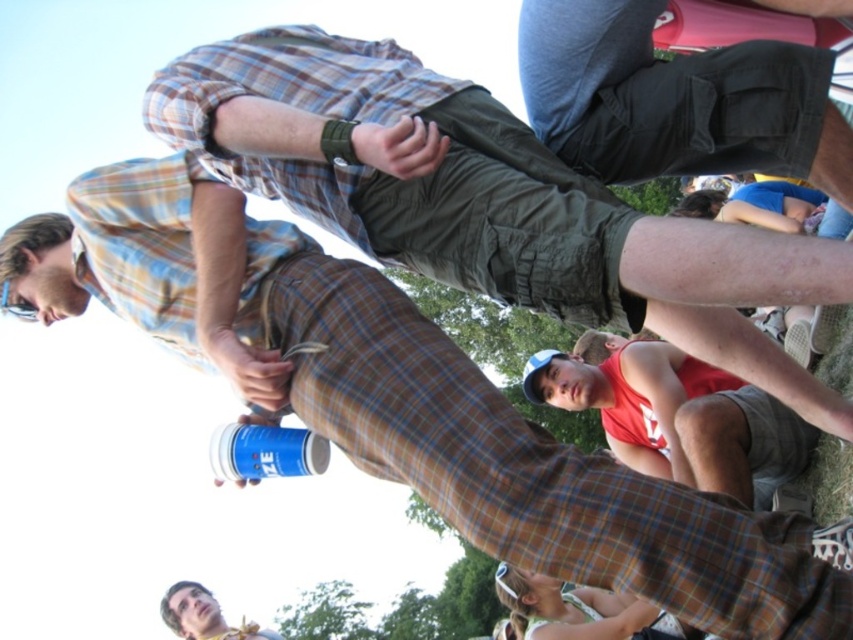
Question: Is dark gray cargo shorts at center positioned in front of smooth skin face at lower left?

Choices:
 (A) no
 (B) yes

Answer: (B)

Question: Can you confirm if dark gray cargo shorts at center is thinner than smooth skin face at lower left?

Choices:
 (A) yes
 (B) no

Answer: (A)

Question: Which point appears farthest from the camera in this image?

Choices:
 (A) (602, 72)
 (B) (207, 611)

Answer: (B)

Question: Which point is farther to the camera?

Choices:
 (A) smooth skin face at lower left
 (B) dark gray cargo shorts at center

Answer: (A)

Question: Can you confirm if dark gray cargo shorts at center is smaller than smooth skin face at lower left?

Choices:
 (A) yes
 (B) no

Answer: (A)